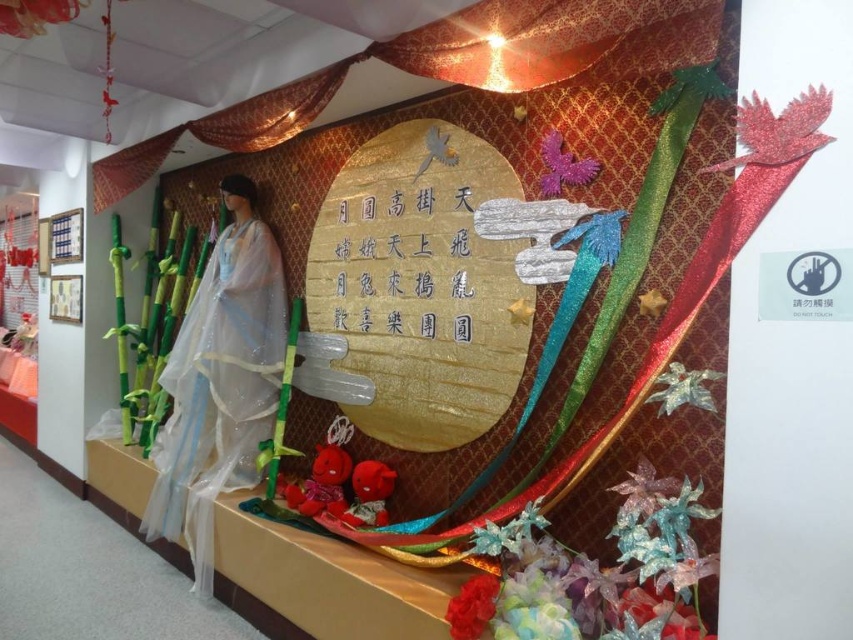
You are an interior designer planning to place a decorative item in this scene. The translucent white dress at left and the gold paper writing at center are already present. If you want to add a new item that must be narrower than both existing objects, where should you place it?

The translucent white dress at left is wider than the gold paper writing at center. To place a new item narrower than both, it should be positioned where there is space between them or in an area not obstructed by either object, ensuring it is narrower than the narrower of the two existing objects, which is the gold paper writing at center.